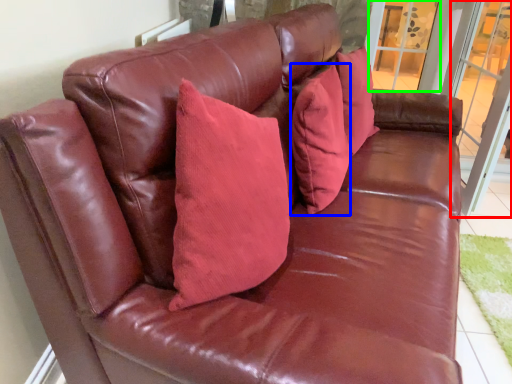
Question: Which object is positioned closest to screen door (highlighted by a red box)? Select from pillow (highlighted by a blue box) and window (highlighted by a green box).

Choices:
 (A) pillow
 (B) window

Answer: (B)